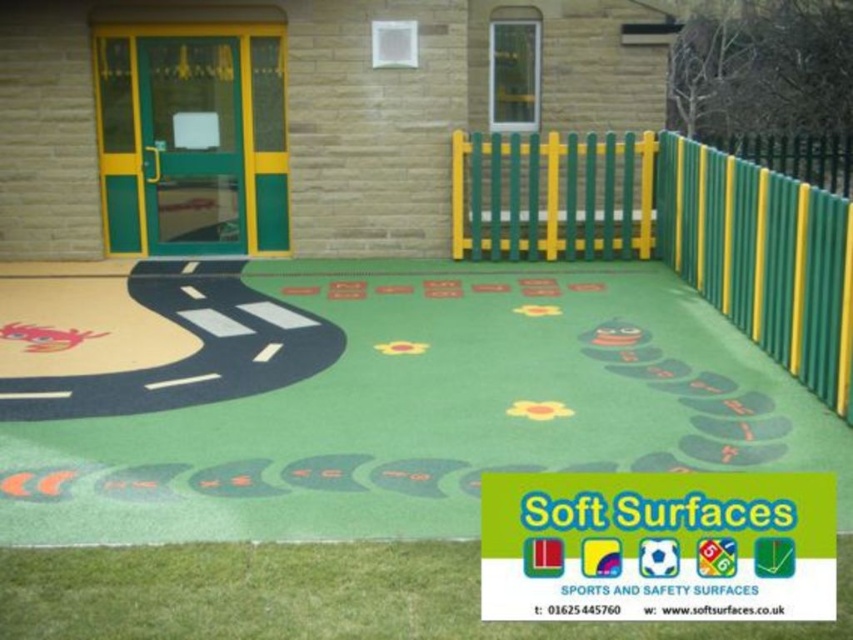
Is green rubber mat at center in front of green plastic fence at center?

Yes, green rubber mat at center is in front of green plastic fence at center.

What do you see at coordinates (366, 396) in the screenshot? I see `green rubber mat at center` at bounding box center [366, 396].

Identify the location of green rubber mat at center. Image resolution: width=853 pixels, height=640 pixels. (366, 396).